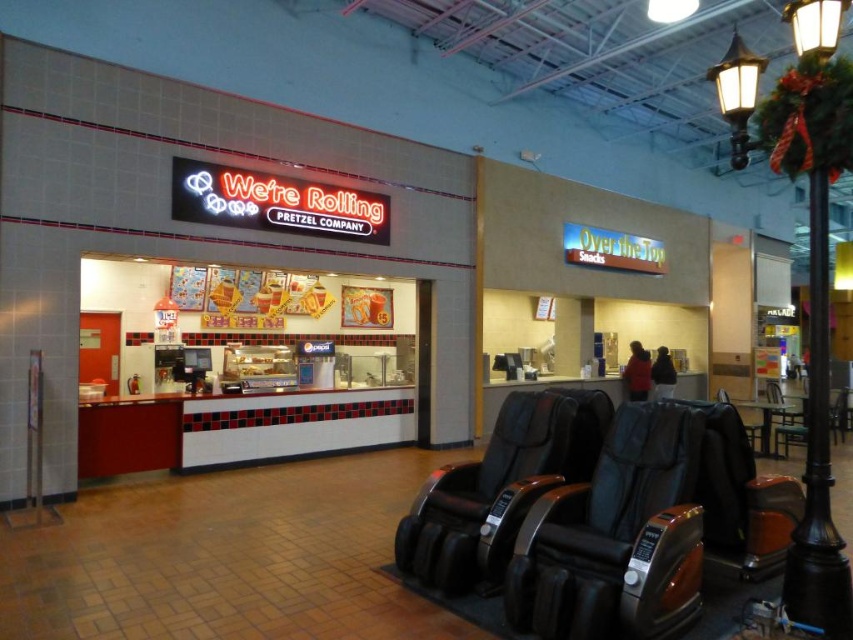
Question: Is the position of matte red counter at center less distant than that of black leather massage chair at center?

Choices:
 (A) yes
 (B) no

Answer: (B)

Question: Which point appears closest to the camera in this image?

Choices:
 (A) (753, 433)
 (B) (647, 557)

Answer: (B)

Question: Which point appears closest to the camera in this image?

Choices:
 (A) (650, 573)
 (B) (759, 445)
 (C) (119, 456)

Answer: (A)

Question: Is black leather swivel chair at lower right positioned in front of black leather massage chair at center?

Choices:
 (A) no
 (B) yes

Answer: (B)

Question: Which point is closer to the camera?

Choices:
 (A) matte red counter at center
 (B) black leather massage chair at center
 (C) black leather swivel chair at lower right

Answer: (C)

Question: Does matte red counter at center lie in front of black leather massage chair at center?

Choices:
 (A) no
 (B) yes

Answer: (A)